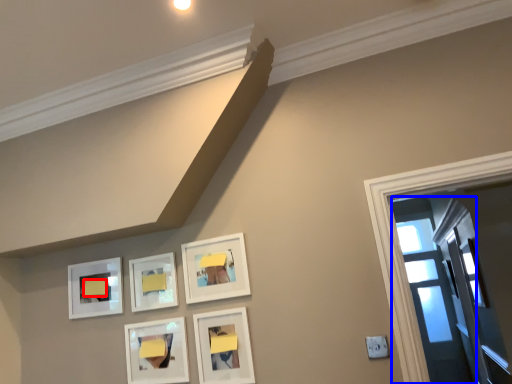
Question: Which of the following is the closest to the observer, furniture (highlighted by a red box) or glass door (highlighted by a blue box)?

Choices:
 (A) furniture
 (B) glass door

Answer: (A)